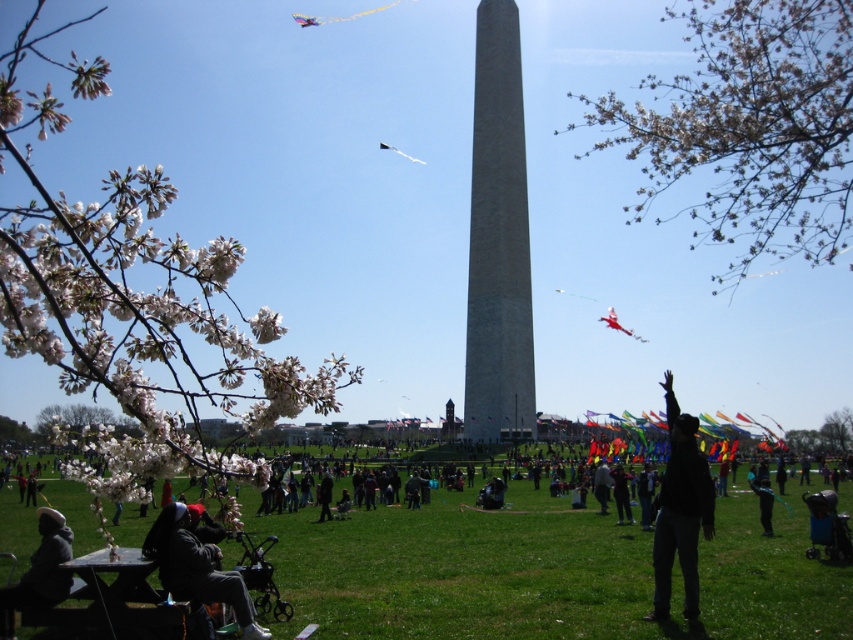
Between dark gray jacket at lower left and metallic kite at upper center, which one is positioned higher?

metallic kite at upper center

Is dark gray jacket at lower left behind metallic kite at upper center?

That is False.

Which is in front, point (171, 564) or point (375, 8)?

Positioned in front is point (171, 564).

Identify the location of dark gray jacket at lower left. The width and height of the screenshot is (853, 640). click(196, 564).

Can you confirm if gray stone obelisk at center is positioned below black matte person at center?

No.

Who is more distant from viewer, [485,148] or [701,483]?

Positioned behind is point [485,148].

Where is `gray stone obelisk at center`? Image resolution: width=853 pixels, height=640 pixels. gray stone obelisk at center is located at coordinates (498, 241).

Is gray stone obelisk at center shorter than translucent white kite at center?

Incorrect, gray stone obelisk at center's height does not fall short of translucent white kite at center's.

Is point (473, 268) positioned after point (380, 148)?

No, (473, 268) is closer to viewer.

Does point (497, 244) lie behind point (408, 156)?

No, it is not.

This screenshot has height=640, width=853. I want to click on gray stone obelisk at center, so click(x=498, y=241).